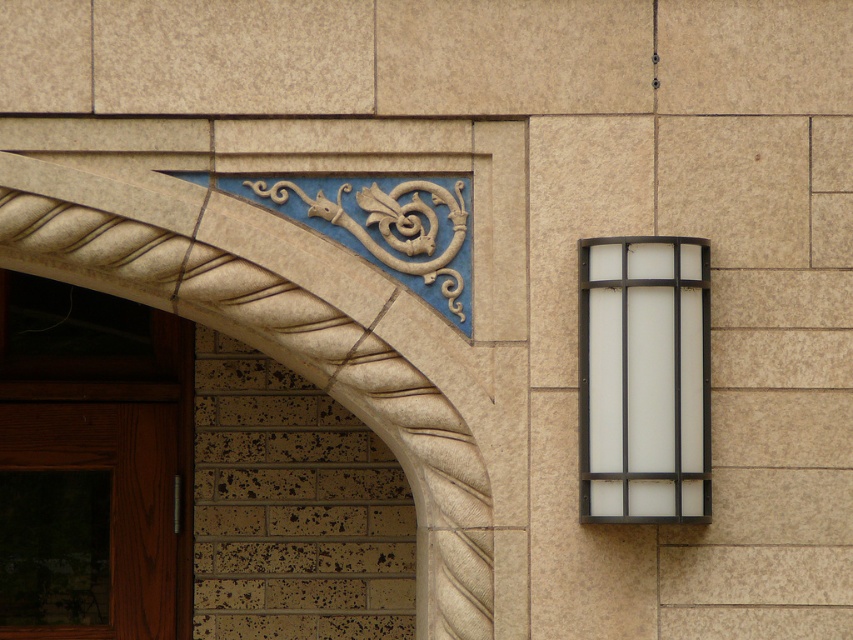
You are an architect examining the building facade. You need to determine the order in which these elements appear from closest to farthest. Which is closer to you? The carved stone archway at upper left or the white frosted glass at right?

The carved stone archway at upper left is closer to you than the white frosted glass at right.

You are a painter who needs to choose between painting the brown wooden door at lower left and the white frosted glass at right. Since you can only paint one, which object should you choose if you want to cover a larger surface area?

The brown wooden door at lower left has a larger width than the white frosted glass at right, so you should choose to paint the brown wooden door at lower left as it has a bigger surface area to cover.